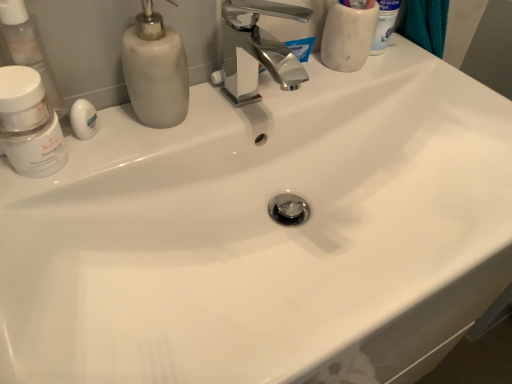
Find the location of a particular element. This screenshot has width=512, height=384. free location in front of white matte jar at left is located at coordinates (41, 260).